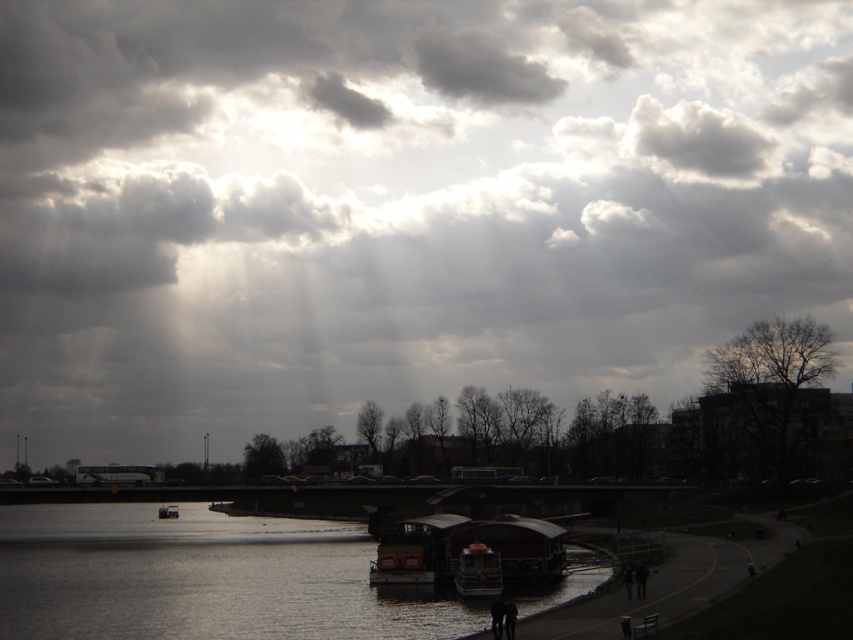
You are standing on the pathway and want to take a photo of the cloudy sky at upper center and the silvery reflective water at lower center. Which object will appear higher in the photo?

The cloudy sky at upper center will appear higher in the photo because it is positioned on the right side of the silvery reflective water at lower center, which is lower in the scene.

You are standing on the pathway on the right side of the image and want to take a photo of the wooden boat at center without the cloudy sky at upper center appearing in the frame. Is this possible given their relative sizes?

The cloudy sky at upper center is much taller than the wooden boat at center, so it would likely dominate the upper part of the frame. To exclude the sky, you would need to angle the camera downward significantly, but this might also crop out parts of the boat. It may not be possible to fully exclude the sky while capturing the boat in its entirety.

You are a photographer wanting to capture the metallic orange lifeboat at lower center and the silvery reflective water at lower center in the same frame. Since you want both objects to be clearly visible, which object should you focus on first to ensure proper exposure, considering their sizes?

The silvery reflective water at lower center is bigger than the metallic orange lifeboat at lower center, so you should focus on the larger object first to ensure proper exposure.